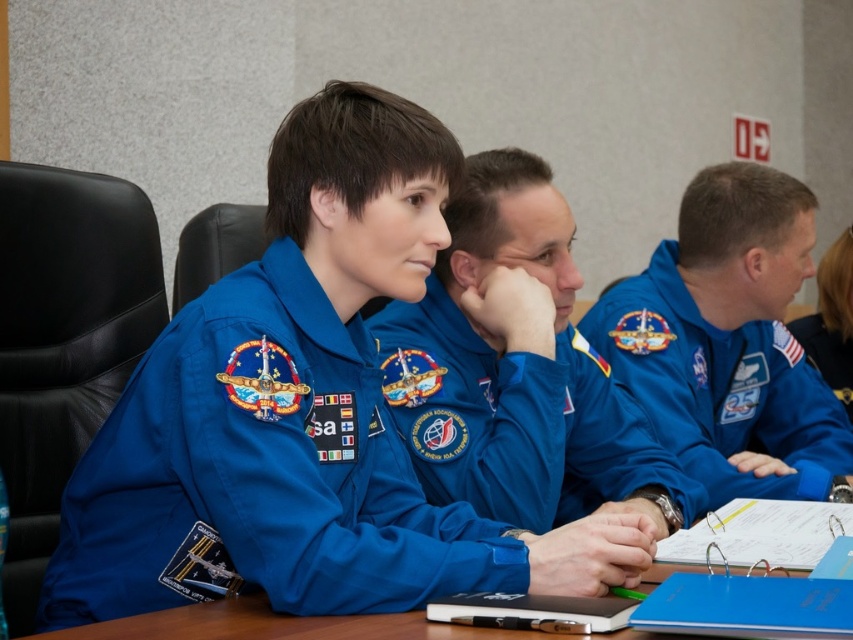
Question: In this image, where is blue fabric jacket at center located relative to wooden table at center?

Choices:
 (A) left
 (B) right

Answer: (B)

Question: Considering the relative positions of blue fabric uniform at center and wooden table at center in the image provided, where is blue fabric uniform at center located with respect to wooden table at center?

Choices:
 (A) left
 (B) right

Answer: (A)

Question: Which point is farther from the camera taking this photo?

Choices:
 (A) (788, 566)
 (B) (746, 349)

Answer: (B)

Question: Which of the following is the farthest from the observer?

Choices:
 (A) [479, 401]
 (B) [241, 602]

Answer: (A)

Question: Is blue fabric uniform at center below blue fabric jacket at center?

Choices:
 (A) no
 (B) yes

Answer: (B)

Question: Which is nearer to the wooden table at center?

Choices:
 (A) blue fabric jacket at center
 (B) blue fabric uniform at center

Answer: (B)